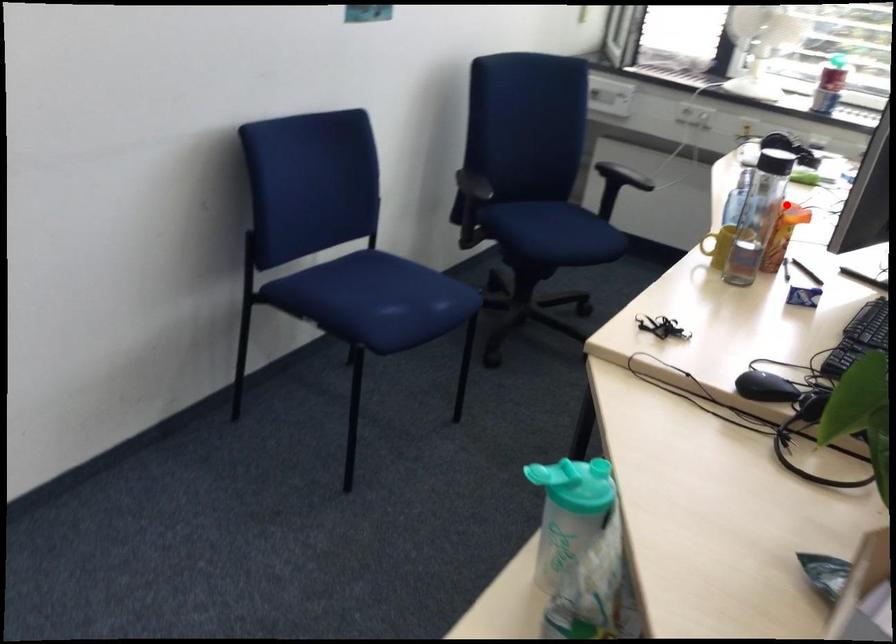
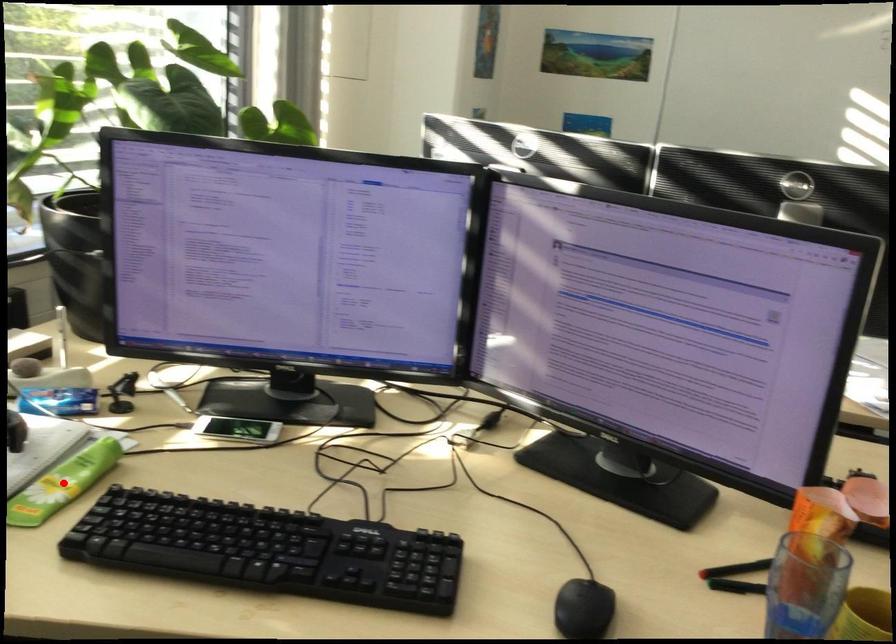
Looking at this image, I am providing you with two images of the same scene from different viewpoints. A red point is marked on the first image and another point is marked on the second image. Is the marked point in image1 the same physical position as the marked point in image2?

No